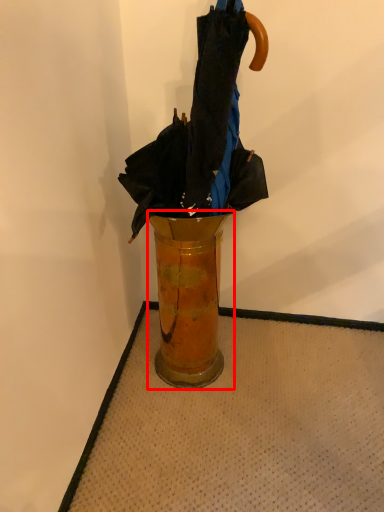
Question: From the image's perspective, where is vase (annotated by the red box) located in relation to umbrella in the image?

Choices:
 (A) above
 (B) below

Answer: (B)